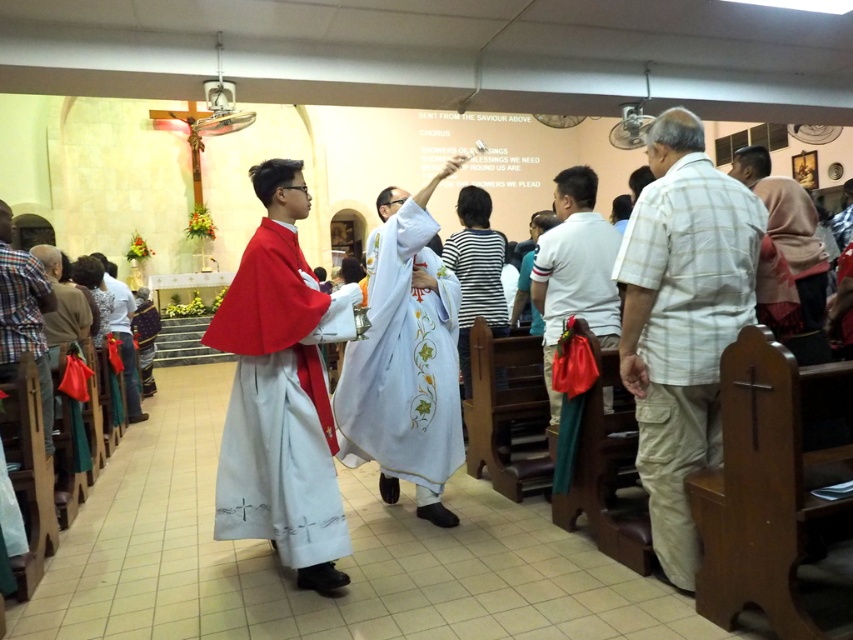
Question: Which point is farther to the camera?

Choices:
 (A) (642, 416)
 (B) (128, 406)
 (C) (140, 355)

Answer: (C)

Question: Does white embroidered robe at center appear over white satin robe at lower left?

Choices:
 (A) yes
 (B) no

Answer: (B)

Question: Is white cotton shirt at center above plaid cotton shirt at lower left?

Choices:
 (A) yes
 (B) no

Answer: (A)

Question: Is white satin robe at center thinner than white cotton shirt at center?

Choices:
 (A) no
 (B) yes

Answer: (A)

Question: Which object is the closest to the white embroidered robe at center?

Choices:
 (A) white satin robe at center
 (B) plaid cotton shirt at right
 (C) light beige plaid shirt at center

Answer: (A)

Question: Which object is farther from the camera taking this photo?

Choices:
 (A) light beige plaid shirt at center
 (B) plaid cotton shirt at right
 (C) white satin robe at lower left
 (D) white cotton shirt at center

Answer: (C)